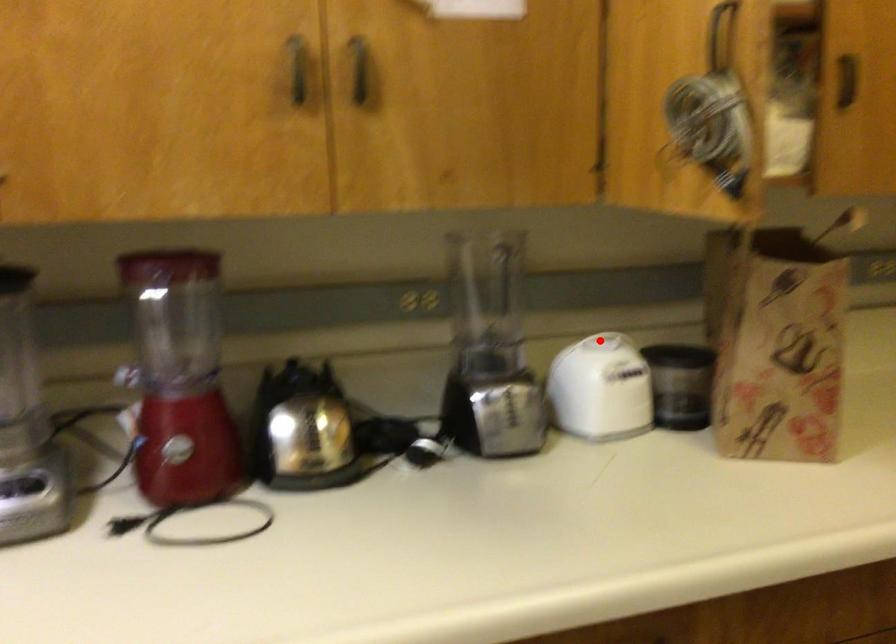
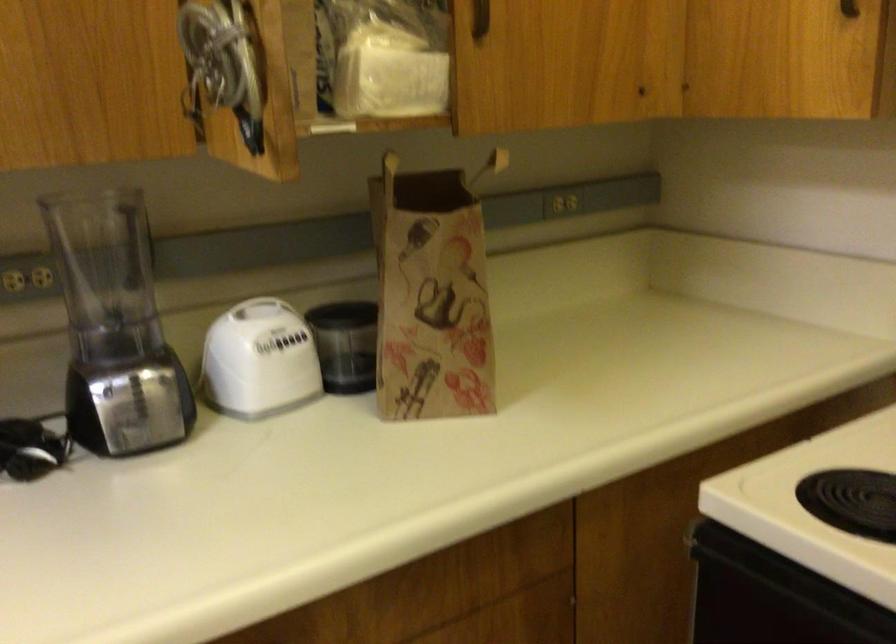
In the second image, find the point that corresponds to the highlighted location in the first image.

(260, 308)